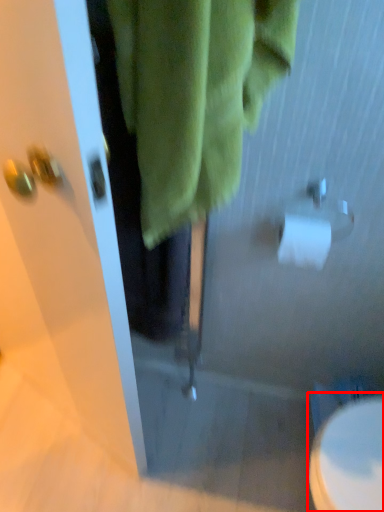
Question: From the image's perspective, considering the relative positions of toilet (annotated by the red box) and toilet paper in the image provided, where is toilet (annotated by the red box) located with respect to the staircase?

Choices:
 (A) below
 (B) above

Answer: (A)